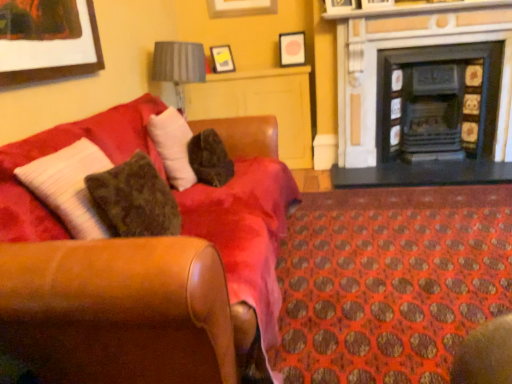
What do you see at coordinates (261, 105) in the screenshot?
I see `wooden cabinet at center` at bounding box center [261, 105].

Locate an element on the screen. The width and height of the screenshot is (512, 384). matte wooden picture frame at upper center, which ranks as the first picture frame in top-to-bottom order is located at coordinates (240, 7).

This screenshot has width=512, height=384. Describe the element at coordinates (438, 100) in the screenshot. I see `black matte fireplace at right, the 2th fireplace in the left-to-right sequence` at that location.

Identify the location of leather couch at left. (245, 232).

The image size is (512, 384). What are the coordinates of `pattern on the left of black matte fireplace at right, the 1th fireplace from the right` in the screenshot? It's located at (390, 281).

From a real-world perspective, between orange fabric carpet at lower right and black matte fireplace at right, the 1th fireplace from the right, who is vertically lower?

orange fabric carpet at lower right.

How many degrees apart are the facing directions of orange fabric carpet at lower right and black matte fireplace at right, the 1th fireplace from the right?

179 degrees separate the facing orientations of orange fabric carpet at lower right and black matte fireplace at right, the 1th fireplace from the right.

Considering the positions of objects orange fabric carpet at lower right and black matte fireplace at right, the 2th fireplace in the left-to-right sequence, in the image provided, who is more to the left, orange fabric carpet at lower right or black matte fireplace at right, the 2th fireplace in the left-to-right sequence,?

Positioned to the left is orange fabric carpet at lower right.

From a real-world perspective, is wooden cabinet at center positioned over gray fabric lampshade at upper center based on gravity?

No.

Who is shorter, wooden cabinet at center or gray fabric lampshade at upper center?

gray fabric lampshade at upper center is shorter.

Is wooden cabinet at center thinner than gray fabric lampshade at upper center?

Yes, wooden cabinet at center is thinner than gray fabric lampshade at upper center.

From a real-world perspective, is matte yellow picture frame at upper center, positioned as the 1th picture frame in bottom-to-top order, physically below matte black picture frame at upper center, arranged as the second picture frame when viewed from the top?

Correct, in the physical world, matte yellow picture frame at upper center, positioned as the 1th picture frame in bottom-to-top order, is lower than matte black picture frame at upper center, arranged as the second picture frame when viewed from the top.

Is matte yellow picture frame at upper center, positioned as the 1th picture frame in bottom-to-top order, at the left side of matte black picture frame at upper center, which is the second picture frame from bottom to top?

Indeed, matte yellow picture frame at upper center, positioned as the 1th picture frame in bottom-to-top order, is positioned on the left side of matte black picture frame at upper center, which is the second picture frame from bottom to top.

Considering the relative sizes of matte yellow picture frame at upper center, positioned as the 1th picture frame in bottom-to-top order, and matte black picture frame at upper center, arranged as the second picture frame when viewed from the top, in the image provided, is matte yellow picture frame at upper center, positioned as the 1th picture frame in bottom-to-top order, smaller than matte black picture frame at upper center, arranged as the second picture frame when viewed from the top,?

Actually, matte yellow picture frame at upper center, positioned as the 1th picture frame in bottom-to-top order, might be larger than matte black picture frame at upper center, arranged as the second picture frame when viewed from the top.

Considering the sizes of objects matte yellow picture frame at upper center, which ranks as the 3th picture frame in top-to-bottom order, and matte black picture frame at upper center, which is the second picture frame from bottom to top, in the image provided, who is thinner, matte yellow picture frame at upper center, which ranks as the 3th picture frame in top-to-bottom order, or matte black picture frame at upper center, which is the second picture frame from bottom to top,?

With smaller width is matte black picture frame at upper center, which is the second picture frame from bottom to top.

From the image's perspective, is gray fabric lampshade at upper center located above matte yellow picture frame at upper center, which ranks as the 3th picture frame in top-to-bottom order?

No, from the image's perspective, gray fabric lampshade at upper center is not over matte yellow picture frame at upper center, which ranks as the 3th picture frame in top-to-bottom order.

How far apart are gray fabric lampshade at upper center and matte yellow picture frame at upper center, which ranks as the 3th picture frame in top-to-bottom order?

gray fabric lampshade at upper center is 27.90 inches from matte yellow picture frame at upper center, which ranks as the 3th picture frame in top-to-bottom order.

Can we say gray fabric lampshade at upper center lies outside matte yellow picture frame at upper center, positioned as the 1th picture frame in bottom-to-top order?

That's correct, gray fabric lampshade at upper center is outside of matte yellow picture frame at upper center, positioned as the 1th picture frame in bottom-to-top order.

Is gray fabric lampshade at upper center facing away from matte yellow picture frame at upper center, positioned as the 1th picture frame in bottom-to-top order?

No, gray fabric lampshade at upper center is not facing the opposite direction of matte yellow picture frame at upper center, positioned as the 1th picture frame in bottom-to-top order.

Which of these two, black tile fireplace at upper right, acting as the 1th fireplace starting from the left, or orange fabric carpet at lower right, is wider?

orange fabric carpet at lower right.

Does black tile fireplace at upper right, which is the second fireplace in right-to-left order, have a larger size compared to orange fabric carpet at lower right?

Yes.

What's the angular difference between black tile fireplace at upper right, which is the second fireplace in right-to-left order, and orange fabric carpet at lower right's facing directions?

179 degrees separate the facing orientations of black tile fireplace at upper right, which is the second fireplace in right-to-left order, and orange fabric carpet at lower right.

From the picture: Are black tile fireplace at upper right, which is the second fireplace in right-to-left order, and orange fabric carpet at lower right far apart?

Yes.

Is matte black picture frame at upper center, arranged as the second picture frame when viewed from the top, turned away from leather couch at left?

No, matte black picture frame at upper center, arranged as the second picture frame when viewed from the top,'s orientation is not away from leather couch at left.

Is matte black picture frame at upper center, which is the second picture frame from bottom to top, smaller than leather couch at left?

Correct, matte black picture frame at upper center, which is the second picture frame from bottom to top, occupies less space than leather couch at left.

Is there a large distance between matte black picture frame at upper center, arranged as the second picture frame when viewed from the top, and leather couch at left?

Yes.

Is matte black picture frame at upper center, arranged as the second picture frame when viewed from the top, inside or outside of matte yellow picture frame at upper center, which ranks as the 3th picture frame in top-to-bottom order?

matte black picture frame at upper center, arranged as the second picture frame when viewed from the top, is outside matte yellow picture frame at upper center, which ranks as the 3th picture frame in top-to-bottom order.

Considering the relative sizes of matte black picture frame at upper center, which is the second picture frame from bottom to top, and matte yellow picture frame at upper center, which ranks as the 3th picture frame in top-to-bottom order, in the image provided, is matte black picture frame at upper center, which is the second picture frame from bottom to top, taller than matte yellow picture frame at upper center, which ranks as the 3th picture frame in top-to-bottom order,?

No.

Is matte black picture frame at upper center, which is the second picture frame from bottom to top, positioned with its back to matte yellow picture frame at upper center, positioned as the 1th picture frame in bottom-to-top order?

That's not correct — matte black picture frame at upper center, which is the second picture frame from bottom to top, is not looking away from matte yellow picture frame at upper center, positioned as the 1th picture frame in bottom-to-top order.

Is point (291, 49) farther from viewer compared to point (222, 48)?

No, it is not.

Which fireplace is the 2nd one when counting from the right side of the orange fabric carpet at lower right? Please provide its 2D coordinates.

[(438, 100)]

Where is `table behind the gray fabric lampshade at upper center`? The height and width of the screenshot is (384, 512). table behind the gray fabric lampshade at upper center is located at coordinates (261, 105).

Estimate the real-world distances between objects in this image. Which object is closer to orange fabric carpet at lower right, gray fabric lampshade at upper center or matte wooden picture frame at upper center, which ranks as the first picture frame in top-to-bottom order?

gray fabric lampshade at upper center is positioned closer to the anchor orange fabric carpet at lower right.

Which object lies further to the anchor point leather couch at left, fuzzy brown pillow at center or black tile fireplace at upper right, acting as the 1th fireplace starting from the left?

The object further to leather couch at left is black tile fireplace at upper right, acting as the 1th fireplace starting from the left.

Considering their positions, is matte yellow picture frame at upper center, which ranks as the 3th picture frame in top-to-bottom order, positioned closer to leather couch at left than black matte fireplace at right, the 1th fireplace from the right?

Based on the image, black matte fireplace at right, the 1th fireplace from the right, appears to be nearer to leather couch at left.

Considering their positions, is black matte fireplace at right, the 1th fireplace from the right, positioned further to matte wooden picture frame at upper center, which ranks as the first picture frame in top-to-bottom order, than fuzzy brown pillow at center?

fuzzy brown pillow at center.

When comparing their distances from orange fabric carpet at lower right, does black tile fireplace at upper right, which is the second fireplace in right-to-left order, or matte yellow picture frame at upper center, which ranks as the 3th picture frame in top-to-bottom order, seem closer?

The object closer to orange fabric carpet at lower right is black tile fireplace at upper right, which is the second fireplace in right-to-left order.

Considering their positions, is matte wooden picture frame at upper center, which ranks as the first picture frame in top-to-bottom order, positioned further to gray fabric lampshade at upper center than matte black picture frame at upper center, which is the second picture frame from bottom to top?

matte black picture frame at upper center, which is the second picture frame from bottom to top, is positioned further to the anchor gray fabric lampshade at upper center.

Which object lies nearer to the anchor point orange fabric carpet at lower right, matte wooden picture frame at upper center, which ranks as the first picture frame in top-to-bottom order, or matte black picture frame at upper center, which is the second picture frame from bottom to top?

matte black picture frame at upper center, which is the second picture frame from bottom to top.

Which object lies nearer to the anchor point matte wooden picture frame at upper center, which appears as the 3th picture frame when ordered from the bottom, leather couch at left or black matte fireplace at right, the 1th fireplace from the right?

black matte fireplace at right, the 1th fireplace from the right, is positioned closer to the anchor matte wooden picture frame at upper center, which appears as the 3th picture frame when ordered from the bottom.

Find the location of `pillow positioned between leather couch at left and gray fabric lampshade at upper center from near to far`. pillow positioned between leather couch at left and gray fabric lampshade at upper center from near to far is located at coordinates (173, 146).

This screenshot has height=384, width=512. I want to click on table positioned between fuzzy brown pillow at center and matte yellow picture frame at upper center, which ranks as the 3th picture frame in top-to-bottom order, from near to far, so click(261, 105).

Locate an element on the screen. pillow between orange fabric carpet at lower right and wooden cabinet at center along the z-axis is located at coordinates (173, 146).

At what (x,y) coordinates should I click in order to perform the action: click on table between orange fabric carpet at lower right and matte wooden picture frame at upper center, which ranks as the first picture frame in top-to-bottom order, from front to back. Please return your answer as a coordinate pair (x, y). This screenshot has width=512, height=384. Looking at the image, I should click on (261, 105).